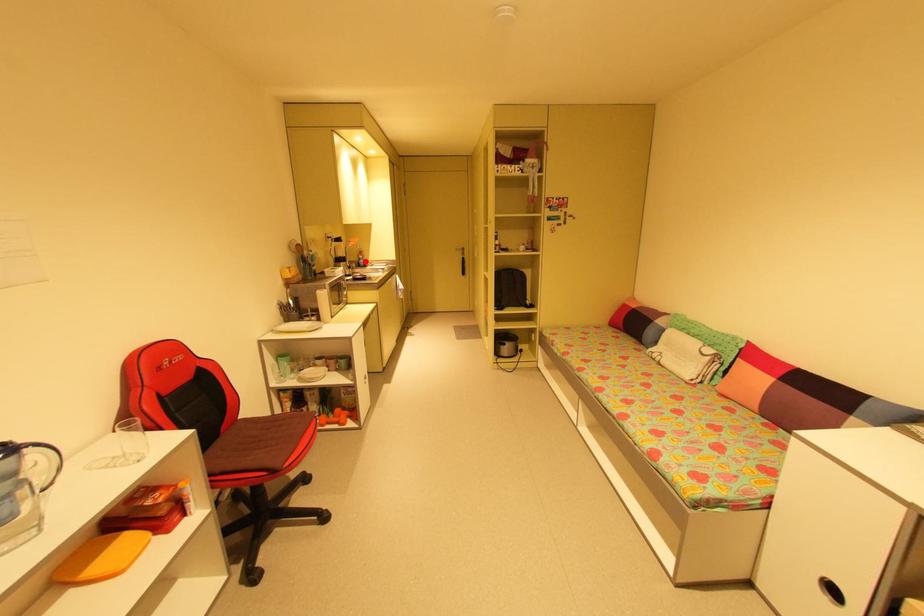
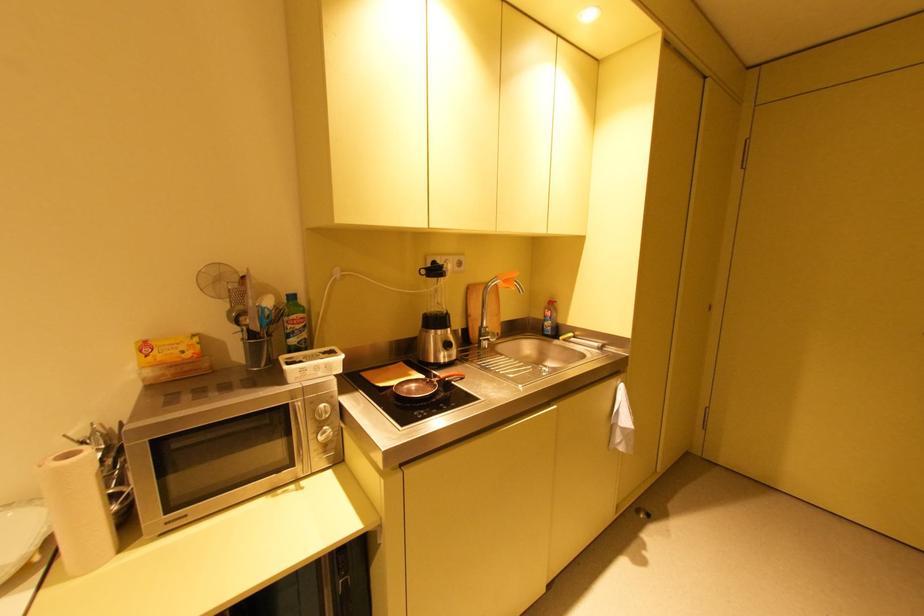
Locate, in the second image, the point that corresponds to the highlighted location in the first image.

(551, 323)